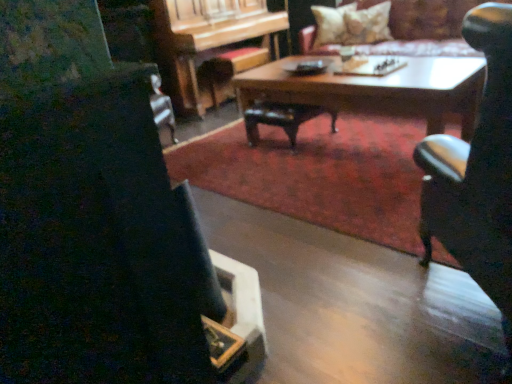
Question: Is point (245, 99) positioned closer to the camera than point (169, 23)?

Choices:
 (A) closer
 (B) farther

Answer: (A)

Question: Is wooden coffee table at center to the left or to the right of wooden piano at center in the image?

Choices:
 (A) right
 (B) left

Answer: (A)

Question: Based on their relative distances, which object is nearer to the black leather chair at right?

Choices:
 (A) wooden piano at center
 (B) soft beige pillow at upper center, which is the first pillow from left to right
 (C) fluffy beige pillow at upper right, placed as the first pillow when sorted from right to left
 (D) wooden coffee table at center
 (E) velvet beige couch at upper center

Answer: (D)

Question: Which of these objects is positioned closest to the soft beige pillow at upper center, which is the first pillow from left to right?

Choices:
 (A) wooden coffee table at center
 (B) fluffy beige pillow at upper right, placed as the 2th pillow when sorted from left to right
 (C) velvet beige couch at upper center
 (D) black leather chair at right
 (E) wooden piano at center

Answer: (B)